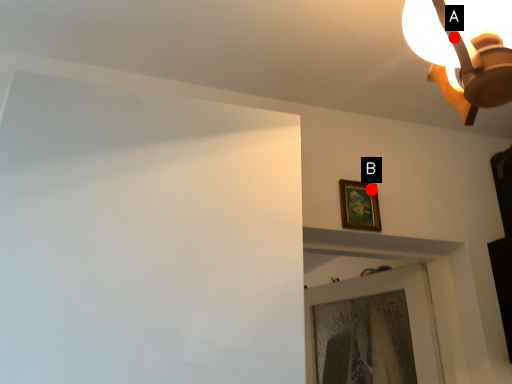
Question: Two points are circled on the image, labeled by A and B beside each circle. Which point is farther to the camera?

Choices:
 (A) A is further
 (B) B is further

Answer: (B)